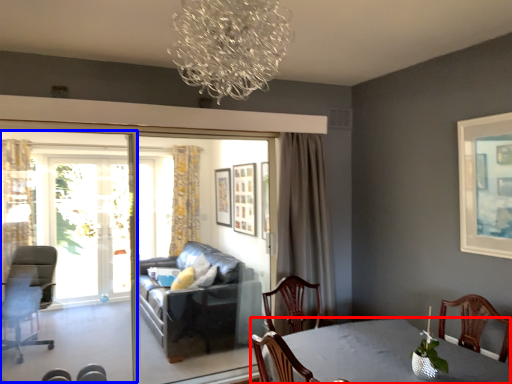
Question: Which point is closer to the camera, table (highlighted by a red box) or screen door (highlighted by a blue box)?

Choices:
 (A) table
 (B) screen door

Answer: (A)